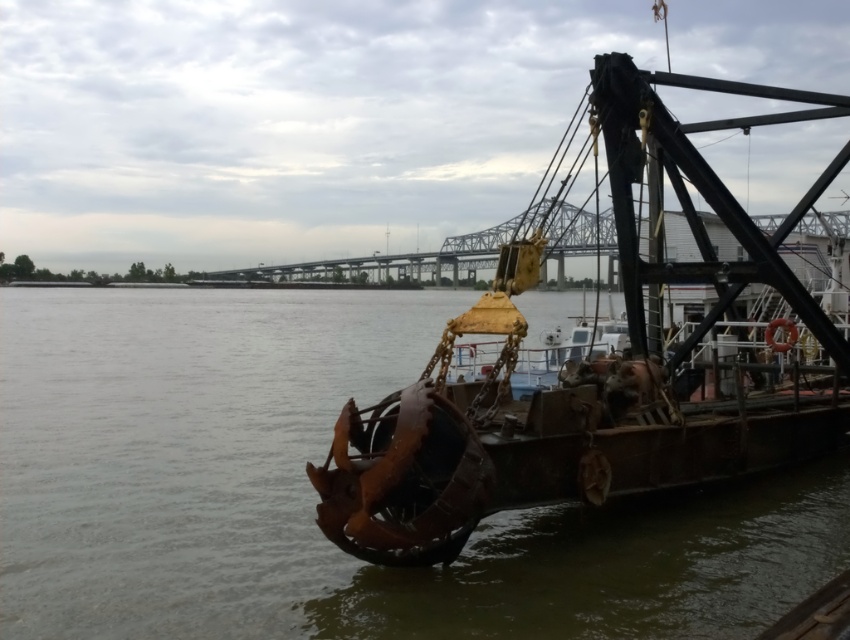
You are a crane operator on the rusty metal barge at center, and you need to lift a heavy container from the rusty metal river at center. The crane has a maximum reach of 10 meters. Can you safely lift the container without moving the barge?

The distance between the rusty metal river at center and the rusty metal barge at center is 12.12 meters. Since the crane can only reach 10 meters, it cannot safely lift the container without moving the barge.

Consider the image. You are a photographer standing on the deck of the vessel and want to take a photo that includes both the point at coordinates point (212, 333) and point (499, 349). Which point will appear closer to the edge of the photo if you frame the shot so that both points are visible?

Point (212, 333) is further to the camera than point (499, 349), so in the photo, point (212, 333) will appear closer to the edge of the photo because it is nearer to the photographer.

You are standing on the dock and see the rusty metal river at center. If you want to throw a small pebble into the river, will it reach the river if you throw it with a force that can reach 9 meters?

The rusty metal river at center is 8.75 meters away from the viewer. Since the pebble can reach 9 meters, it will successfully land in the river.